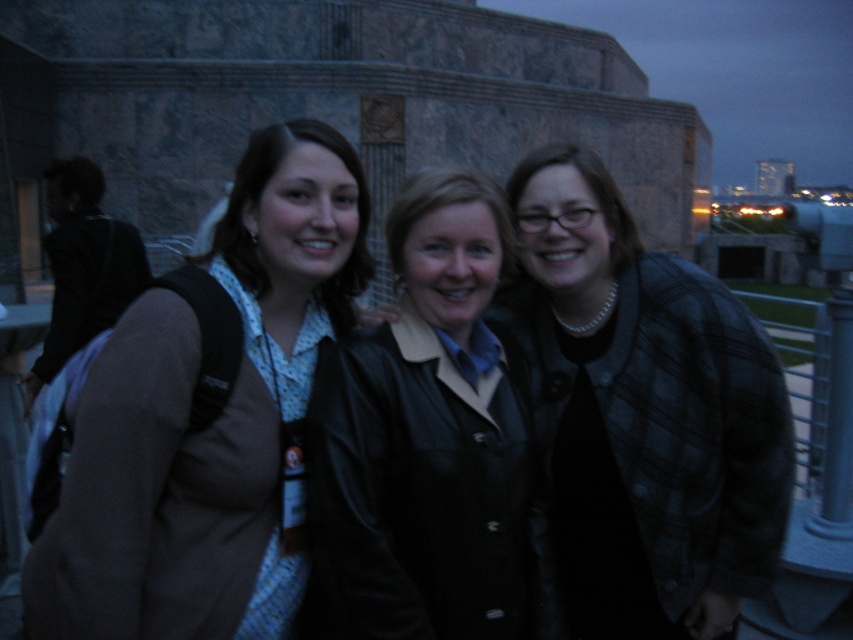
Question: Is the position of brown leather jacket at center more distant than that of plaid wool jacket at center?

Choices:
 (A) yes
 (B) no

Answer: (B)

Question: Where is brown leather jacket at center located in relation to plaid wool jacket at center in the image?

Choices:
 (A) right
 (B) left

Answer: (B)

Question: Is the position of brown leather jacket at center more distant than that of black leather jacket at center?

Choices:
 (A) no
 (B) yes

Answer: (A)

Question: Which of these objects is positioned farthest from the plaid wool jacket at center?

Choices:
 (A) brown leather jacket at center
 (B) black leather jacket at center

Answer: (A)

Question: Which point is farther to the camera?

Choices:
 (A) brown leather jacket at center
 (B) black leather jacket at center
 (C) plaid wool jacket at center

Answer: (C)

Question: Which of the following is the farthest from the observer?

Choices:
 (A) pyautogui.click(x=62, y=552)
 (B) pyautogui.click(x=682, y=458)

Answer: (B)